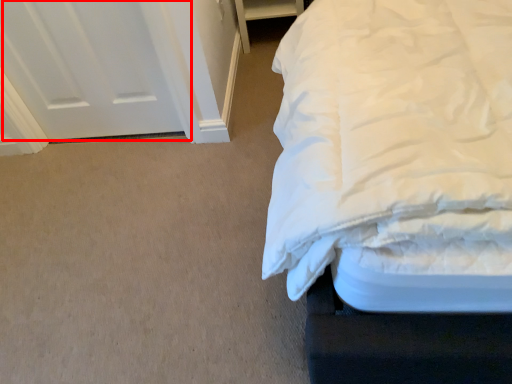
Question: From the image, what is the correct spatial relationship of door (annotated by the red box) in relation to furniture?

Choices:
 (A) left
 (B) right

Answer: (A)